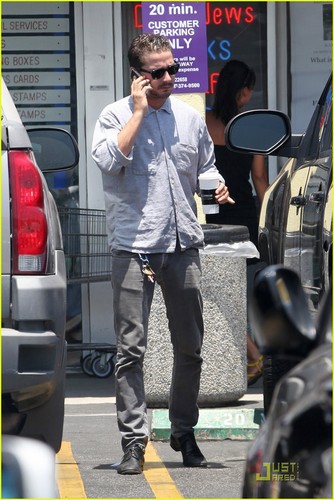
You are a GUI agent. You are given a task and a screenshot of the screen. Output one action in this format:
    pyautogui.click(x=<x>, y=<y>)
    Task: Click on the cup
    The image size is (334, 500).
    Given the screenshot: What is the action you would take?
    pyautogui.click(x=207, y=188)